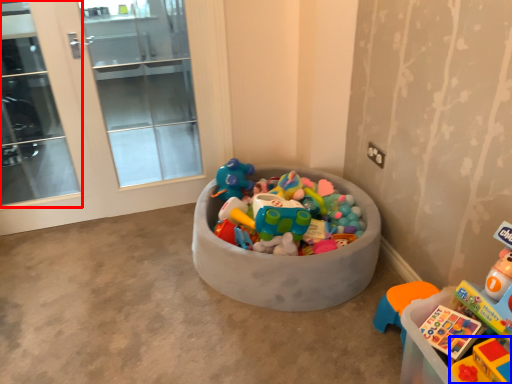
Question: Which of the following is the farthest to the observer, screen door (highlighted by a red box) or toy (highlighted by a blue box)?

Choices:
 (A) screen door
 (B) toy

Answer: (A)